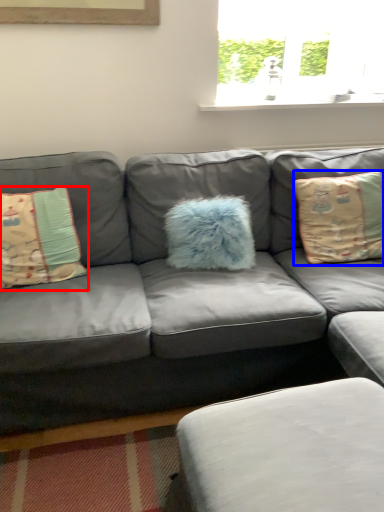
Question: Among these objects, which one is nearest to the camera, pillow (highlighted by a red box) or pillow (highlighted by a blue box)?

Choices:
 (A) pillow
 (B) pillow

Answer: (A)